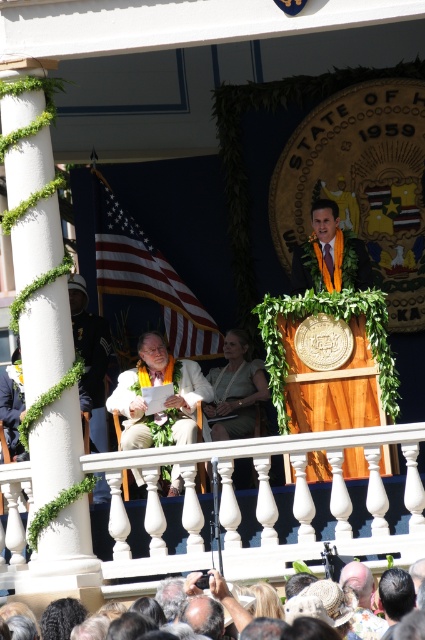
You are a photographer positioned at the back of the stage. You need to capture a photo of both the light brown leather jacket at center and the matte orange lei at center in the same frame. Given that your camera has a maximum focus range of 8 meters, will you be able to capture both objects clearly in the photo?

The distance between the light brown leather jacket at center and the matte orange lei at center is 7.71 meters, which is within the camera maximum focus range of 8 meters. Therefore, both objects can be captured clearly in the same frame.

You are attending the event and need to place a new decorative flag exactly halfway between the American flag at left and the podium. Where should you place it?

The American flag at left is located at point (147, 276). To determine the halfway point between it and the podium, you would need the coordinates of the podium. Since the podium is on the right side behind the man, its coordinates are not provided. Without the podium coordinates, the exact halfway point cannot be calculated.